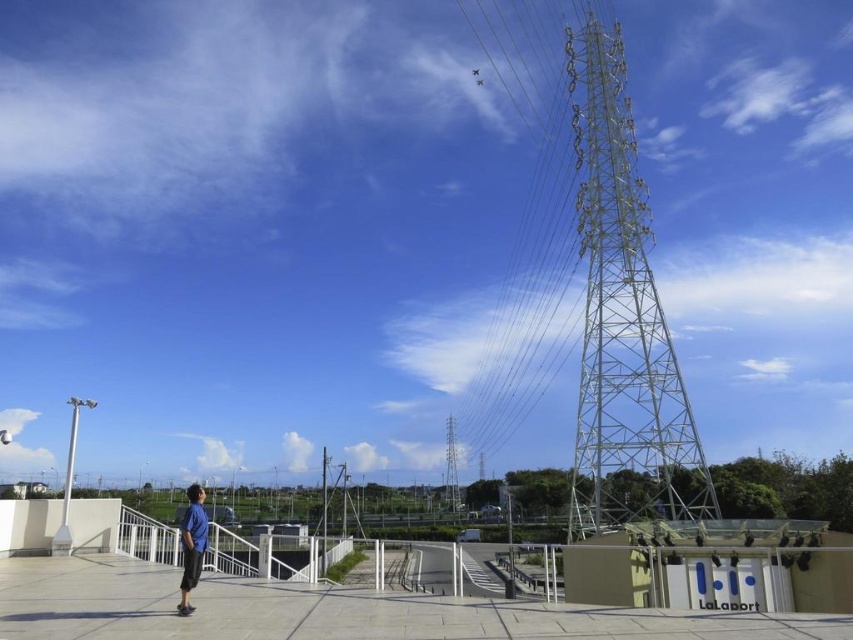
Question: Among these points, which one is nearest to the camera?

Choices:
 (A) pyautogui.click(x=451, y=451)
 (B) pyautogui.click(x=567, y=24)
 (C) pyautogui.click(x=309, y=620)
 (D) pyautogui.click(x=190, y=573)

Answer: (C)

Question: Which of the following is the closest to the observer?

Choices:
 (A) metallic silver tower at right
 (B) white concrete path at center

Answer: (B)

Question: Estimate the real-world distances between objects in this image. Which object is closer to the white concrete path at center?

Choices:
 (A) metallic silver tower at center
 (B) metallic silver tower at right
 (C) blue fabric shirt at lower left
 (D) metallic silver power line at right

Answer: (C)

Question: Can you confirm if metallic silver tower at right is positioned to the left of metallic silver tower at center?

Choices:
 (A) yes
 (B) no

Answer: (B)

Question: Does metallic silver power line at right lie behind blue fabric shirt at lower left?

Choices:
 (A) yes
 (B) no

Answer: (A)

Question: Does white concrete path at center have a smaller size compared to metallic silver power line at right?

Choices:
 (A) yes
 (B) no

Answer: (A)